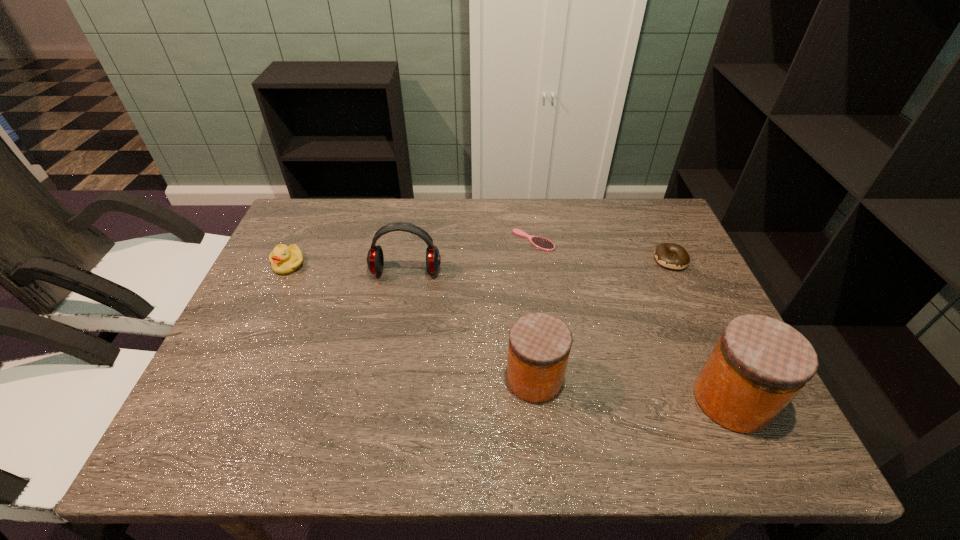
In order to click on free space at the left edge of the desktop in this screenshot , I will do `click(234, 357)`.

The width and height of the screenshot is (960, 540). I want to click on vacant area at the right edge, so click(684, 316).

In the image, there is a desktop. Identify the location of vacant region at the far left corner. (306, 235).

In the image, there is a desktop. Where is `vacant space at the near left corner`? This screenshot has height=540, width=960. vacant space at the near left corner is located at coordinates (205, 399).

Locate an element on the screen. This screenshot has width=960, height=540. free space at the far right corner of the desktop is located at coordinates (657, 220).

Image resolution: width=960 pixels, height=540 pixels. In order to click on vacant area that lies between the earphone and the hairbrush in this screenshot , I will do `click(469, 256)`.

Locate an element on the screen. The image size is (960, 540). vacant area that lies between the second object from left to right and the doughnut is located at coordinates (539, 266).

This screenshot has height=540, width=960. In order to click on vacant area between the left jar and the tallest object in this screenshot , I will do `click(634, 389)`.

Where is `empty space that is in between the shorter jar and the duckling`? empty space that is in between the shorter jar and the duckling is located at coordinates (412, 321).

Image resolution: width=960 pixels, height=540 pixels. I want to click on free point between the left jar and the right jar, so click(x=634, y=389).